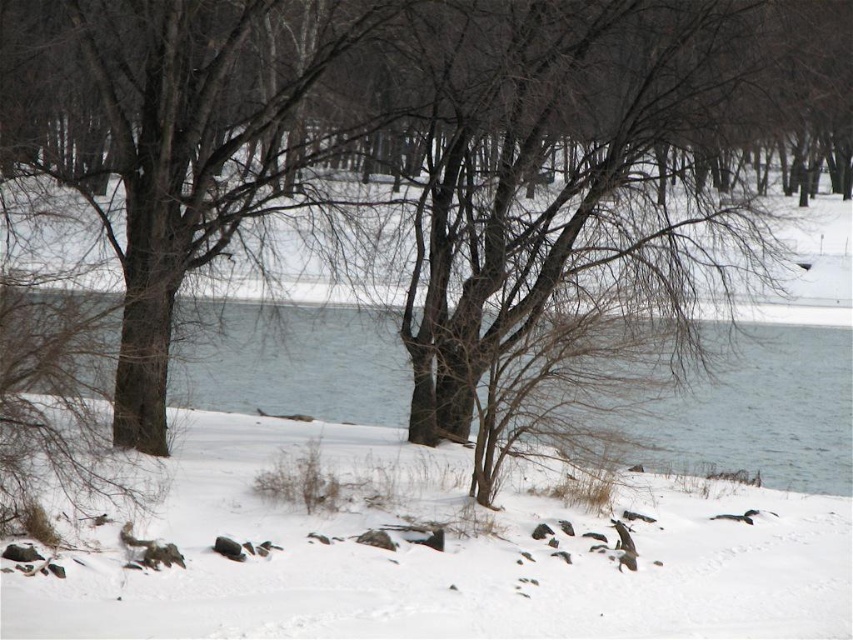
Where is the white fluffy snow at center located in the image?

The white fluffy snow at center is located at point (444, 563) in the image.

You are standing at point (444, 563) in the winter landscape. What do you see directly beneath your feet?

You see white fluffy snow at center directly beneath your feet at point (444, 563).